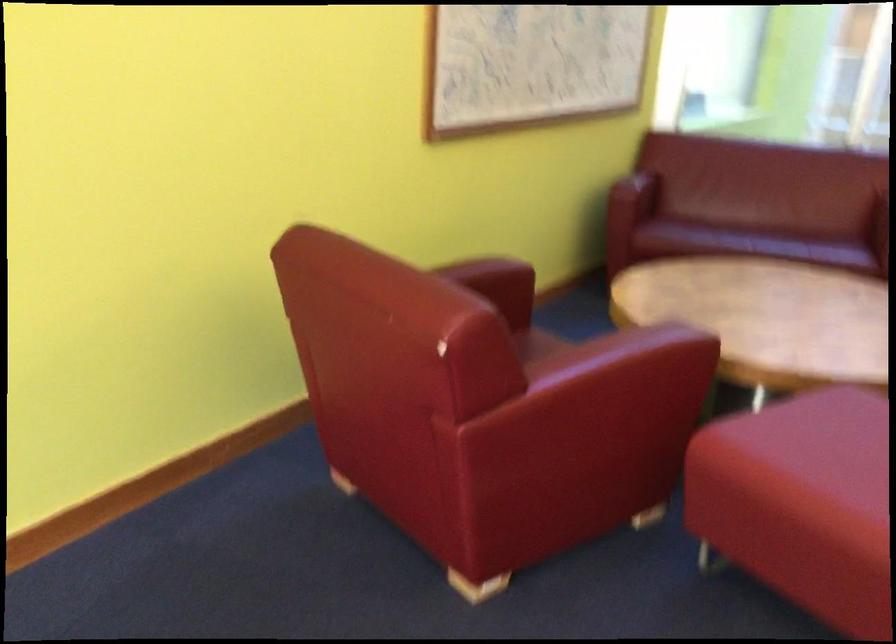
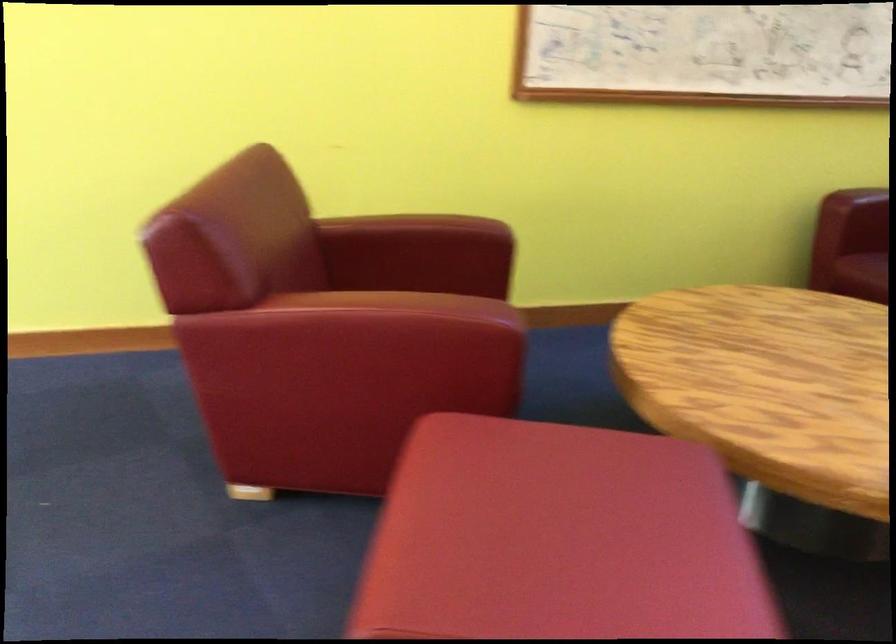
Find the pixel in the second image that matches [606,357] in the first image.

(356, 301)